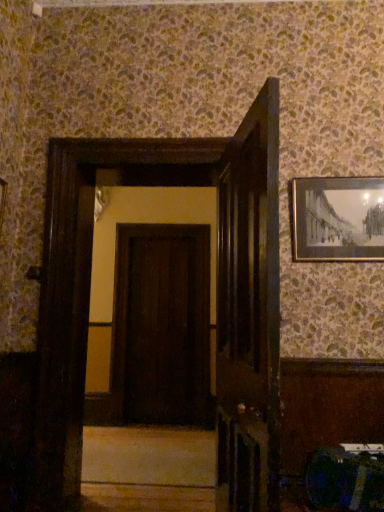
Question: Is gold-framed picture at upper right wider or thinner than dark wood door at center, marked as the second door in a back-to-front arrangement?

Choices:
 (A) thin
 (B) wide

Answer: (A)

Question: Considering the positions of gold-framed picture at upper right and dark wood door at center, marked as the second door in a back-to-front arrangement, in the image, is gold-framed picture at upper right taller or shorter than dark wood door at center, marked as the second door in a back-to-front arrangement,?

Choices:
 (A) tall
 (B) short

Answer: (B)

Question: Which is farther from the dark brown wood door at center, positioned as the second door in front-to-back order?

Choices:
 (A) smooth beige stair at center
 (B) dark wood door at center, marked as the second door in a back-to-front arrangement
 (C) gold-framed picture at upper right

Answer: (B)

Question: Which is farther from the dark brown wood door at center, marked as the second door in a right-to-left arrangement?

Choices:
 (A) dark wood door at center, arranged as the first door when viewed from the front
 (B) smooth beige stair at center
 (C) gold-framed picture at upper right

Answer: (A)